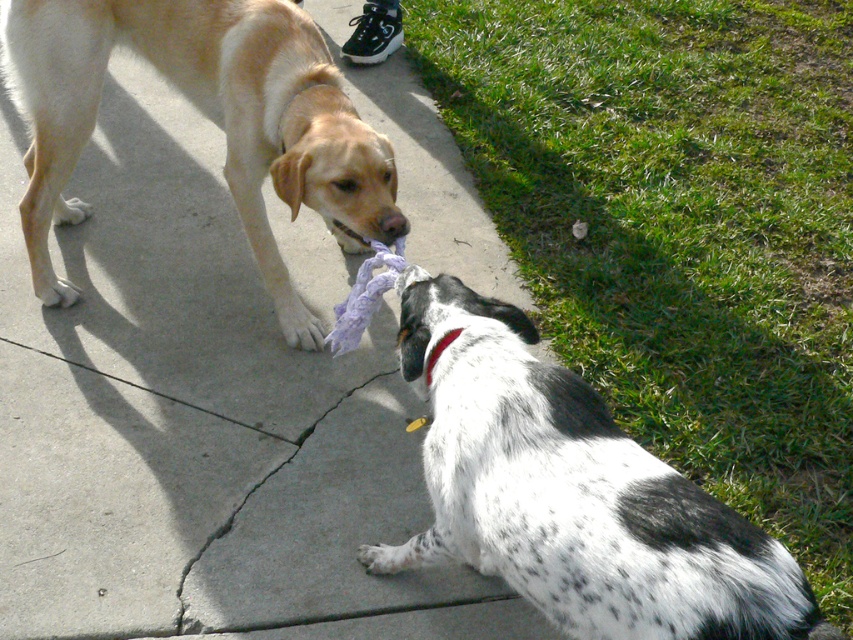
Question: Which object is positioned farthest from the black fabric neckband at center?

Choices:
 (A) spotted fur dog at lower right
 (B) light brown fur at left

Answer: (B)

Question: Is the position of spotted fur dog at lower right less distant than that of black fabric neckband at center?

Choices:
 (A) no
 (B) yes

Answer: (B)

Question: Can you confirm if spotted fur dog at lower right is bigger than black fabric neckband at center?

Choices:
 (A) yes
 (B) no

Answer: (A)

Question: Is the position of light brown fur at left more distant than that of black fabric neckband at center?

Choices:
 (A) yes
 (B) no

Answer: (A)

Question: Which point appears farthest from the camera in this image?

Choices:
 (A) (583, 406)
 (B) (347, 230)
 (C) (426, 365)

Answer: (B)

Question: Among these objects, which one is nearest to the camera?

Choices:
 (A) light brown fur at left
 (B) spotted fur dog at lower right

Answer: (B)